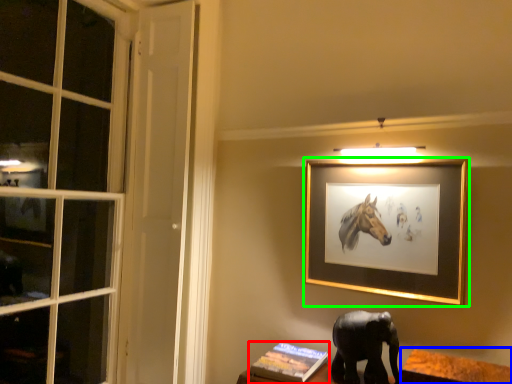
Question: Estimate the real-world distances between objects in this image. Which object is closer to book (highlighted by a red box), table (highlighted by a blue box) or picture frame (highlighted by a green box)?

Choices:
 (A) table
 (B) picture frame

Answer: (A)